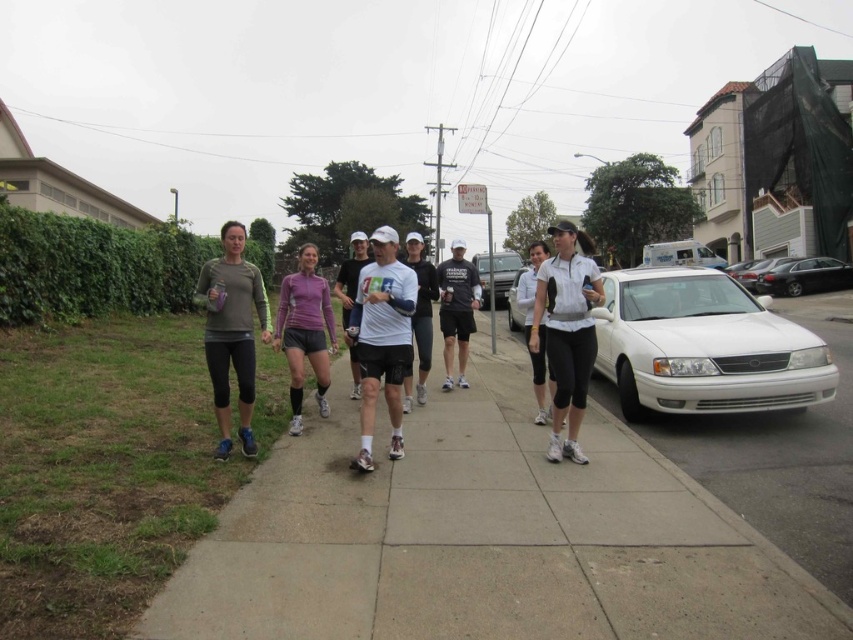
You are a photographer standing at the edge of the sidewalk. You want to take a photo of the group of people walking along the sidewalk. The point you are focusing on is at coordinate point (381, 339). Which object in the scene is this point located on?

The point (381, 339) is located on the white matte t shirt at center.

Consider the image. You are a pedestrian trying to cross the street from the gray concrete sidewalk at center to the other side. There is a metallic silver suv at center parked on the road. Considering the lengths of both objects, which one is shorter and therefore might require you to step over or around it?

The gray concrete sidewalk at center is shorter than the metallic silver suv at center, so the sidewalk is shorter and you might need to adjust your path accordingly.